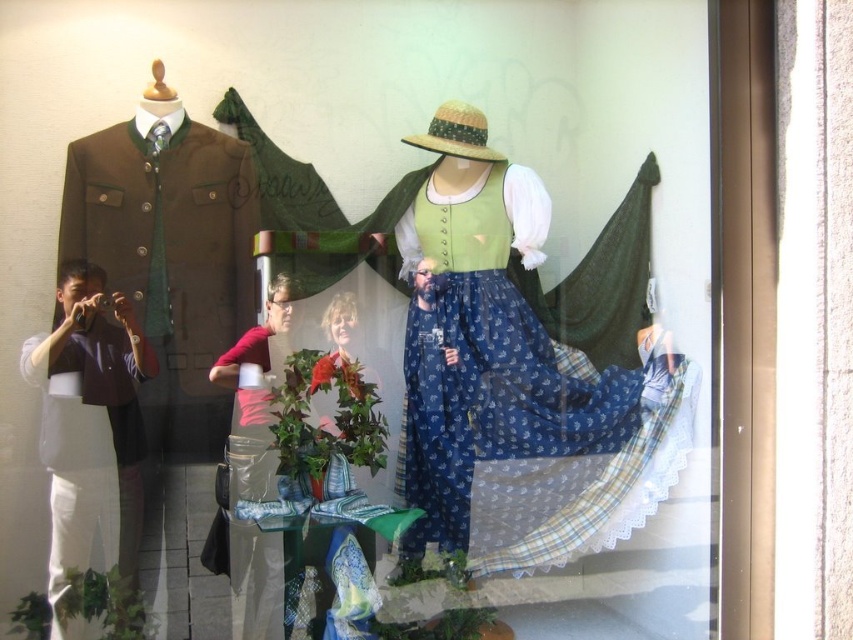
Question: Among these points, which one is nearest to the camera?

Choices:
 (A) (373, 400)
 (B) (88, 564)

Answer: (B)

Question: Is matte black jacket at left positioned behind strawtexturehat at center?

Choices:
 (A) no
 (B) yes

Answer: (A)

Question: Can you confirm if blue printed skirt at center is wider than smooth skin portrait at center?

Choices:
 (A) yes
 (B) no

Answer: (A)

Question: Which object appears farthest from the camera in this image?

Choices:
 (A) blue printed skirt at center
 (B) strawtexturehat at center
 (C) pink fabric at center
 (D) matte brown jacket at left

Answer: (A)

Question: Based on their relative distances, which object is nearer to the strawtexturehat at center?

Choices:
 (A) smooth skin portrait at center
 (B) matte black jacket at left
 (C) blue printed skirt at center

Answer: (C)

Question: Does matte brown jacket at left have a larger size compared to matte black jacket at left?

Choices:
 (A) no
 (B) yes

Answer: (B)